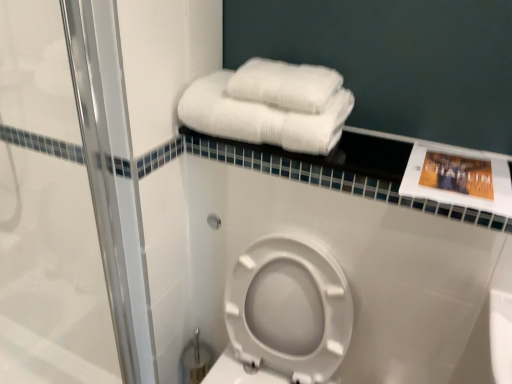
Question: From a real-world perspective, is white fluffy towels at upper right, which is counted as the 1th towel, starting from the bottom, positioned under white fluffy towels at upper center, which ranks as the 1th towel in top-to-bottom order, based on gravity?

Choices:
 (A) no
 (B) yes

Answer: (B)

Question: Is white fluffy towels at upper right, which is counted as the 1th towel, starting from the bottom, closer to the viewer compared to white fluffy towels at upper center, which ranks as the 1th towel in top-to-bottom order?

Choices:
 (A) no
 (B) yes

Answer: (B)

Question: Is white fluffy towels at upper right, which is counted as the 1th towel, starting from the bottom, to the right of white fluffy towels at upper center, which appears as the second towel when ordered from the bottom, from the viewer's perspective?

Choices:
 (A) no
 (B) yes

Answer: (A)

Question: Would you say white fluffy towels at upper right, which is counted as the 1th towel, starting from the bottom, contains white fluffy towels at upper center, which ranks as the 1th towel in top-to-bottom order?

Choices:
 (A) no
 (B) yes

Answer: (B)

Question: From a real-world perspective, is white fluffy towels at upper right, which is counted as the 1th towel, starting from the bottom, physically above white fluffy towels at upper center, which appears as the second towel when ordered from the bottom?

Choices:
 (A) no
 (B) yes

Answer: (A)

Question: Are white fluffy towels at upper right, which is counted as the 1th towel, starting from the bottom, and white fluffy towels at upper center, which appears as the second towel when ordered from the bottom, making contact?

Choices:
 (A) yes
 (B) no

Answer: (A)

Question: Considering the relative positions of clear glass shower door at left and white fluffy towels at upper center, which appears as the second towel when ordered from the bottom, in the image provided, is clear glass shower door at left to the left of white fluffy towels at upper center, which appears as the second towel when ordered from the bottom, from the viewer's perspective?

Choices:
 (A) no
 (B) yes

Answer: (B)

Question: Is clear glass shower door at left aimed at white fluffy towels at upper center, which appears as the second towel when ordered from the bottom?

Choices:
 (A) no
 (B) yes

Answer: (A)

Question: Can you confirm if clear glass shower door at left is smaller than white fluffy towels at upper center, which appears as the second towel when ordered from the bottom?

Choices:
 (A) no
 (B) yes

Answer: (A)

Question: Is clear glass shower door at left shorter than white fluffy towels at upper center, which appears as the second towel when ordered from the bottom?

Choices:
 (A) no
 (B) yes

Answer: (A)

Question: From a real-world perspective, is clear glass shower door at left beneath white fluffy towels at upper center, which appears as the second towel when ordered from the bottom?

Choices:
 (A) no
 (B) yes

Answer: (B)

Question: Is clear glass shower door at left thinner than white fluffy towels at upper center, which appears as the second towel when ordered from the bottom?

Choices:
 (A) no
 (B) yes

Answer: (B)

Question: Is white fluffy towels at upper center, which ranks as the 1th towel in top-to-bottom order, located outside white plastic toilet at lower center?

Choices:
 (A) yes
 (B) no

Answer: (A)